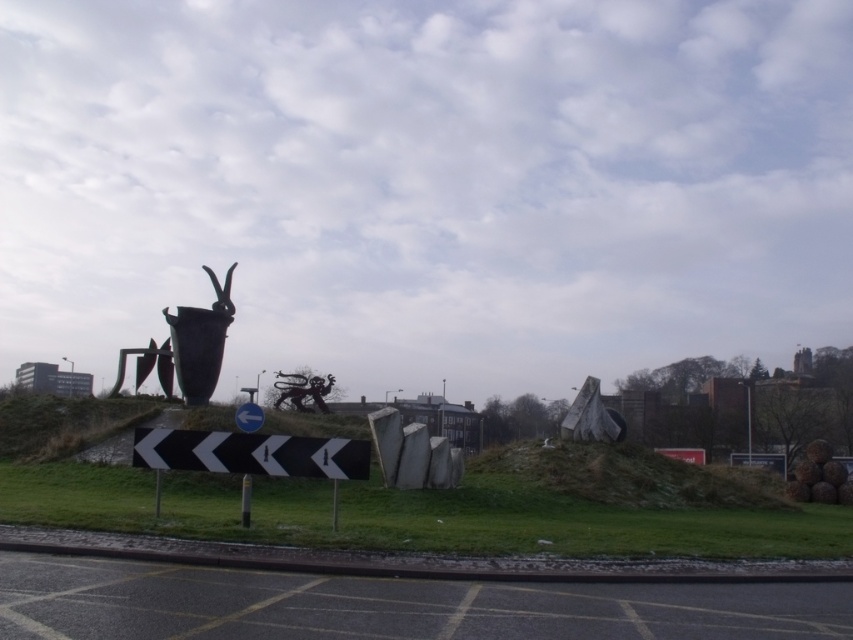
You are standing on the road and want to walk towards the sculpture. Which object, the green grass at lower center or the smooth concrete slabs at center, would you step on first?

The green grass at lower center is closer to the viewer than the smooth concrete slabs at center, so you would step on the green grass at lower center first.

You are standing at the road with the black and white chevron sign indicating a mandatory left turn. You see two points in the sculpture installation. Which point is closer to you, point (181, 353) or point (410, 428)?

Point (410, 428) is closer to you because point (181, 353) is behind it.

You are a gardener who needs to mow the lawn. You see the green grass at lower center and the polished bronze vase at center. Which area should you avoid mowing to prevent damaging the sculpture?

You should avoid mowing around the polished bronze vase at center because the green grass at lower center is taller than the polished bronze vase at center, indicating the vase is part of the sculpture and needs protection.